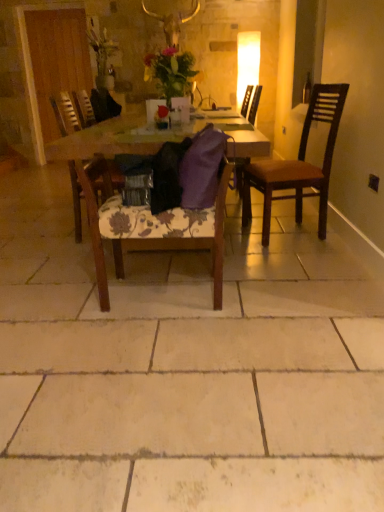
Measure the distance between point (242, 64) and camera.

The depth of point (242, 64) is 5.67 meters.

What do you see at coordinates (71, 111) in the screenshot?
I see `wooden chair at center, the first chair positioned from the left` at bounding box center [71, 111].

Measure the distance between point (307, 85) and camera.

Point (307, 85) and camera are 14.11 feet apart from each other.

At what (x,y) coordinates should I click in order to perform the action: click on dark brown wood chair at right, which appears as the first chair when viewed from the right. Please return your answer as a coordinate pair (x, y). This screenshot has width=384, height=512. Looking at the image, I should click on (299, 164).

Identify the location of matte white lampshade at upper center. (247, 62).

From the image's perspective, is wooden table at center beneath wooden chair at center, the first chair positioned from the left?

No, from the image's perspective, wooden table at center is not beneath wooden chair at center, the first chair positioned from the left.

From a real-world perspective, is wooden table at center above or below wooden chair at center, the first chair positioned from the left?

In terms of real-world spatial position, wooden table at center is below wooden chair at center, the first chair positioned from the left.

How far apart are wooden table at center and wooden chair at center, the first chair positioned from the left?

wooden table at center and wooden chair at center, the first chair positioned from the left, are 18.52 inches apart.

Is matte floral arrangement at center aimed at transparent glass bottle at upper right?

No, matte floral arrangement at center is not facing towards transparent glass bottle at upper right.

Considering the relative sizes of matte floral arrangement at center and transparent glass bottle at upper right in the image provided, is matte floral arrangement at center shorter than transparent glass bottle at upper right?

In fact, matte floral arrangement at center may be taller than transparent glass bottle at upper right.

From the image's perspective, between matte floral arrangement at center and transparent glass bottle at upper right, who is located below?

From the image's view, matte floral arrangement at center is below.

Is the depth of dark brown wood chair at right, which appears as the first chair when viewed from the right, greater than that of purple fabric pillow at center?

Yes, dark brown wood chair at right, which appears as the first chair when viewed from the right, is behind purple fabric pillow at center.

From a real-world perspective, which object stands above the other?

purple fabric pillow at center, from a real-world perspective.

Who is shorter, dark brown wood chair at right, the 3th chair positioned from the left, or purple fabric pillow at center?

With less height is purple fabric pillow at center.

Does dark brown wood chair at right, which appears as the first chair when viewed from the right, have a greater width compared to purple fabric pillow at center?

Yes.

Is dark brown wood chair at right, the 3th chair positioned from the left, in contact with transparent glass bottle at upper right?

No.

Is dark brown wood chair at right, which appears as the first chair when viewed from the right, oriented away from transparent glass bottle at upper right?

No, dark brown wood chair at right, which appears as the first chair when viewed from the right, is not facing away from transparent glass bottle at upper right.

Which object is positioned more to the right, dark brown wood chair at right, the 3th chair positioned from the left, or transparent glass bottle at upper right?

Positioned to the right is transparent glass bottle at upper right.

Considering the relative sizes of dark brown wood chair at right, which appears as the first chair when viewed from the right, and transparent glass bottle at upper right in the image provided, is dark brown wood chair at right, which appears as the first chair when viewed from the right, thinner than transparent glass bottle at upper right?

Incorrect, the width of dark brown wood chair at right, which appears as the first chair when viewed from the right, is not less than that of transparent glass bottle at upper right.

Is purple fabric pillow at center directly adjacent to matte floral arrangement at center?

No, purple fabric pillow at center is not with matte floral arrangement at center.

Is matte floral arrangement at center inside purple fabric pillow at center?

No, matte floral arrangement at center is not surrounded by purple fabric pillow at center.

Can you confirm if purple fabric pillow at center is taller than matte floral arrangement at center?

In fact, purple fabric pillow at center may be shorter than matte floral arrangement at center.

Between point (210, 197) and point (170, 71), which one is positioned in front?

The point (210, 197) is closer.

Is transparent glass bottle at upper right in front of or behind matte floral arrangement at center in the image?

In the image, transparent glass bottle at upper right appears behind matte floral arrangement at center.

Based on the photo, which is more to the right, transparent glass bottle at upper right or matte floral arrangement at center?

transparent glass bottle at upper right.

From the image's perspective, who appears lower, transparent glass bottle at upper right or matte floral arrangement at center?

matte floral arrangement at center is shown below in the image.

Is matte floral arrangement at center surrounded by transparent glass bottle at upper right?

No.

Which object is further away from the camera taking this photo, matte white lampshade at upper center or purple fabric pillow at center?

matte white lampshade at upper center.

Is purple fabric pillow at center at the back of matte white lampshade at upper center?

That's not correct — matte white lampshade at upper center is not looking away from purple fabric pillow at center.

From a real-world perspective, which is physically above, matte white lampshade at upper center or purple fabric pillow at center?

In real-world perspective, matte white lampshade at upper center is above.

Considering the relative sizes of matte white lampshade at upper center and purple fabric pillow at center in the image provided, is matte white lampshade at upper center wider than purple fabric pillow at center?

No, matte white lampshade at upper center is not wider than purple fabric pillow at center.

Locate an element on the screen. This screenshot has width=384, height=512. the 2nd chair to the left of the wooden table at center, counting from the anchor's position is located at coordinates (71, 111).

Where is `flower lying in front of the transparent glass bottle at upper right`? The height and width of the screenshot is (512, 384). flower lying in front of the transparent glass bottle at upper right is located at coordinates (171, 71).

Which object lies further to the anchor point wooden chair at center, the first chair positioned from the left, wooden chair at center, placed as the 2th chair when sorted from right to left, or matte white lampshade at upper center?

The object further to wooden chair at center, the first chair positioned from the left, is matte white lampshade at upper center.

Which object lies nearer to the anchor point wooden chair at center, acting as the third chair starting from the right, purple fabric pillow at center or dark brown wood chair at right, the 3th chair positioned from the left?

The object closer to wooden chair at center, acting as the third chair starting from the right, is purple fabric pillow at center.

Which object lies nearer to the anchor point dark brown wood chair at right, which appears as the first chair when viewed from the right, transparent glass bottle at upper right or wooden chair at center, acting as the third chair starting from the right?

Based on the image, transparent glass bottle at upper right appears to be nearer to dark brown wood chair at right, which appears as the first chair when viewed from the right.

From the image, which object appears to be nearer to dark brown wood chair at right, the 3th chair positioned from the left, wooden chair at center, acting as the third chair starting from the right, or matte floral arrangement at center?

matte floral arrangement at center is positioned closer to the anchor dark brown wood chair at right, the 3th chair positioned from the left.

Looking at the image, which one is located closer to wooden table at center, purple fabric pillow at center or wooden chair at center, which ranks as the second chair in left-to-right order?

wooden chair at center, which ranks as the second chair in left-to-right order, is positioned closer to the anchor wooden table at center.

Based on their spatial positions, is dark brown wood chair at right, the 3th chair positioned from the left, or purple fabric pillow at center closer to matte white lampshade at upper center?

dark brown wood chair at right, the 3th chair positioned from the left, is closer to matte white lampshade at upper center.

Based on their spatial positions, is matte floral arrangement at center or dark brown wood chair at right, which appears as the first chair when viewed from the right, further from matte white lampshade at upper center?

Based on the image, matte floral arrangement at center appears to be further to matte white lampshade at upper center.

From the image, which object appears to be nearer to matte white lampshade at upper center, wooden chair at center, placed as the 2th chair when sorted from right to left, or transparent glass bottle at upper right?

The object closer to matte white lampshade at upper center is transparent glass bottle at upper right.

This screenshot has height=512, width=384. In order to click on desk between wooden chair at center, acting as the third chair starting from the right, and dark brown wood chair at right, which appears as the first chair when viewed from the right in this screenshot , I will do `click(116, 139)`.

Locate an element on the screen. Image resolution: width=384 pixels, height=512 pixels. flower positioned between purple fabric pillow at center and transparent glass bottle at upper right from near to far is located at coordinates (171, 71).

Find the location of `flower between wooden chair at center, which ranks as the second chair in left-to-right order, and matte white lampshade at upper center, along the z-axis`. flower between wooden chair at center, which ranks as the second chair in left-to-right order, and matte white lampshade at upper center, along the z-axis is located at coordinates click(x=171, y=71).

At what (x,y) coordinates should I click in order to perform the action: click on flower located between wooden table at center and transparent glass bottle at upper right in the depth direction. Please return your answer as a coordinate pair (x, y). The height and width of the screenshot is (512, 384). Looking at the image, I should click on (171, 71).